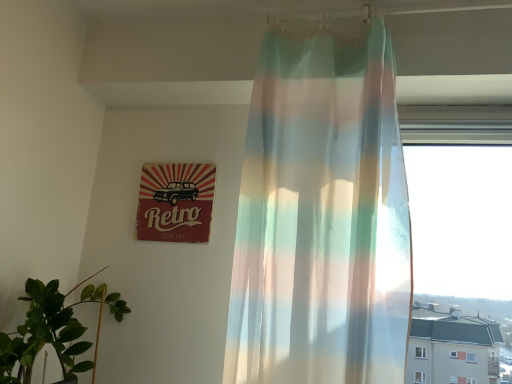
Question: Considering their positions, is translucent pastel curtain at center located in front of or behind retro paper sign at upper left?

Choices:
 (A) behind
 (B) front

Answer: (B)

Question: From a real-world perspective, is translucent pastel curtain at center positioned above or below retro paper sign at upper left?

Choices:
 (A) above
 (B) below

Answer: (B)

Question: Based on their relative distances, which object is farther from the retro paper sign at upper left?

Choices:
 (A) translucent pastel curtain at center
 (B) green leafy plant at lower left

Answer: (A)

Question: Which is nearer to the translucent pastel curtain at center?

Choices:
 (A) green leafy plant at lower left
 (B) retro paper sign at upper left

Answer: (B)